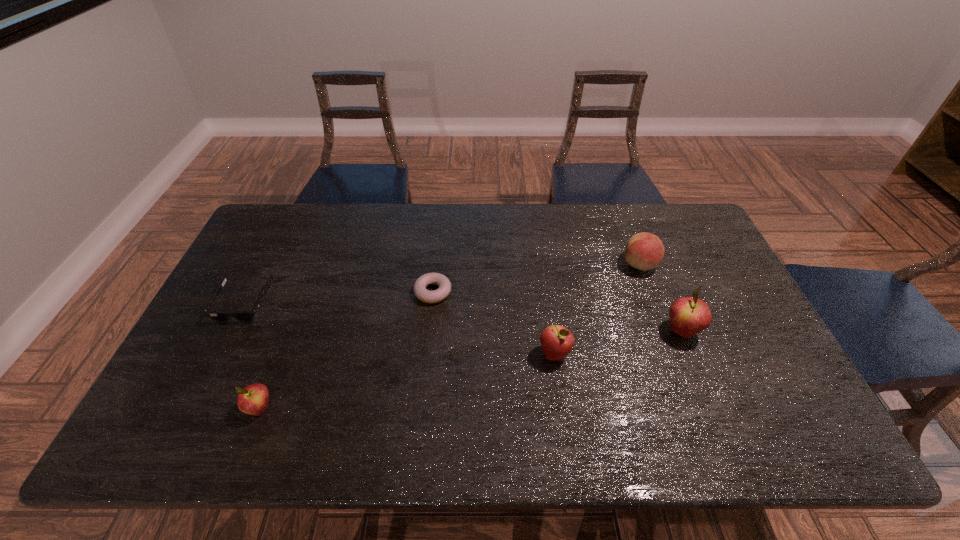
At what (x,y) coordinates should I click in order to perform the action: click on vacant space that satisfies the following two spatial constraints: 1. on the temples of the leftmost object; 2. on the left side of the fourth object from left to right. Please return your answer as a coordinate pair (x, y). Looking at the image, I should click on (218, 354).